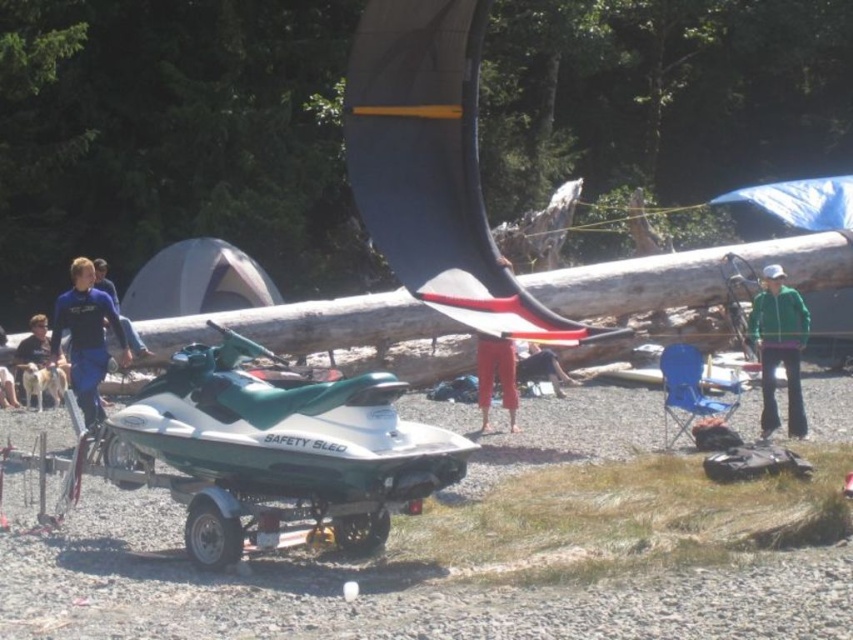
Question: Which object is farther from the camera taking this photo?

Choices:
 (A) blue wetsuit at left
 (B) dark blue fabric pants at center

Answer: (B)

Question: Does green fleece jacket at right appear on the left side of dark blue wetsuit at lower left?

Choices:
 (A) yes
 (B) no

Answer: (B)

Question: Among these objects, which one is nearest to the camera?

Choices:
 (A) blue wetsuit at left
 (B) dark blue fabric pants at center

Answer: (A)

Question: Is green fleece jacket at right closer to the viewer compared to red cotton pants at center?

Choices:
 (A) no
 (B) yes

Answer: (B)

Question: Does red cotton pants at center have a lesser width compared to dark blue wetsuit at lower left?

Choices:
 (A) no
 (B) yes

Answer: (A)

Question: Based on their relative distances, which object is farther from the dark blue wetsuit at lower left?

Choices:
 (A) dark blue fabric pants at center
 (B) blue wetsuit at left

Answer: (A)